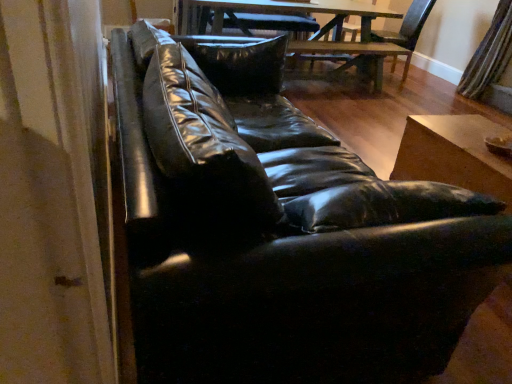
You are a GUI agent. You are given a task and a screenshot of the screen. Output one action in this format:
    pyautogui.click(x=<x>, y=<y>)
    Task: Click on the wooden table at center, which is the 2th table from bottom to top
    This screenshot has width=512, height=384.
    Given the screenshot: What is the action you would take?
    click(x=319, y=30)

This screenshot has width=512, height=384. What do you see at coordinates (406, 32) in the screenshot?
I see `dark wood swivel chair at center` at bounding box center [406, 32].

Find the location of `wooden table at center, which ranks as the first table in back-to-front order`. wooden table at center, which ranks as the first table in back-to-front order is located at coordinates (319, 30).

From a real-world perspective, is striped fabric curtain at right physically above dark wood swivel chair at center?

Correct, in the physical world, striped fabric curtain at right is higher than dark wood swivel chair at center.

Between striped fabric curtain at right and dark wood swivel chair at center, which one is positioned in front?

striped fabric curtain at right is in front.

From the image's perspective, does striped fabric curtain at right appear lower than dark wood swivel chair at center?

Yes.

Is point (490, 76) closer or farther from the camera than point (408, 19)?

Point (490, 76) is positioned closer to the camera compared to point (408, 19).

Considering the relative sizes of dark wood swivel chair at center and wooden table at lower right, which appears as the first table when ordered from the bottom, in the image provided, is dark wood swivel chair at center thinner than wooden table at lower right, which appears as the first table when ordered from the bottom,?

No.

Based on the photo, is dark wood swivel chair at center positioned with its back to wooden table at lower right, which appears as the first table when ordered from the bottom?

No, dark wood swivel chair at center is not facing the opposite direction of wooden table at lower right, which appears as the first table when ordered from the bottom.

From the image's perspective, which object appears higher, dark wood swivel chair at center or wooden table at lower right, placed as the 2th table when sorted from back to front?

dark wood swivel chair at center appears higher in the image.

Is dark wood swivel chair at center positioned behind wooden table at lower right, placed as the 2th table when sorted from back to front?

Yes, dark wood swivel chair at center is further from the viewer.

Based on the photo, is wooden table at lower right, positioned as the second table in top-to-bottom order, oriented away from wooden table at center, which is the 2th table from bottom to top?

No, wooden table at center, which is the 2th table from bottom to top, is not at the back of wooden table at lower right, positioned as the second table in top-to-bottom order.

From a real-world perspective, between wooden table at lower right, placed as the 2th table when sorted from back to front, and wooden table at center, which ranks as the first table in back-to-front order, who is vertically lower?

From a 3D spatial view, wooden table at lower right, placed as the 2th table when sorted from back to front, is below.

Is wooden table at lower right, which appears as the first table when ordered from the bottom, not inside wooden table at center, which ranks as the first table in back-to-front order?

Yes, wooden table at lower right, which appears as the first table when ordered from the bottom, is not within wooden table at center, which ranks as the first table in back-to-front order.

Between wooden table at lower right, positioned as the second table in top-to-bottom order, and wooden table at center, which ranks as the first table in back-to-front order, which one has smaller width?

wooden table at lower right, positioned as the second table in top-to-bottom order.

From the picture: Which of these two, wooden table at center, which is the 2th table from front to back, or striped fabric curtain at right, stands shorter?

With less height is wooden table at center, which is the 2th table from front to back.

Is wooden table at center, acting as the 1th table starting from the top, turned away from striped fabric curtain at right?

No, wooden table at center, acting as the 1th table starting from the top, is not facing away from striped fabric curtain at right.

Is wooden table at center, acting as the 1th table starting from the top, not inside striped fabric curtain at right?

Absolutely, wooden table at center, acting as the 1th table starting from the top, is external to striped fabric curtain at right.

Which of these two, wooden table at lower right, placed as the 2th table when sorted from back to front, or dark wood swivel chair at center, is thinner?

With smaller width is wooden table at lower right, placed as the 2th table when sorted from back to front.

Would you say wooden table at lower right, placed as the 2th table when sorted from back to front, is to the left or to the right of dark wood swivel chair at center in the picture?

From the image, it's evident that wooden table at lower right, placed as the 2th table when sorted from back to front, is to the left of dark wood swivel chair at center.

Is the surface of wooden table at lower right, which appears as the first table when ordered from the bottom, in direct contact with dark wood swivel chair at center?

There is a gap between wooden table at lower right, which appears as the first table when ordered from the bottom, and dark wood swivel chair at center.

Between wooden table at lower right, placed as the 2th table when sorted from back to front, and dark wood swivel chair at center, which one has smaller size?

wooden table at lower right, placed as the 2th table when sorted from back to front, is smaller.

The image size is (512, 384). Find the location of `swivel chair that is above the wooden table at center, acting as the 1th table starting from the top (from a real-world perspective)`. swivel chair that is above the wooden table at center, acting as the 1th table starting from the top (from a real-world perspective) is located at coordinates (406, 32).

From the picture: From a real-world perspective, who is located lower, wooden table at center, which is the 2th table from bottom to top, or dark wood swivel chair at center?

wooden table at center, which is the 2th table from bottom to top, is physically lower.

Is there a large distance between wooden table at center, which is the 2th table from front to back, and dark wood swivel chair at center?

No, there isn't a large distance between wooden table at center, which is the 2th table from front to back, and dark wood swivel chair at center.

Which object is thinner, wooden table at center, which ranks as the first table in back-to-front order, or dark wood swivel chair at center?

dark wood swivel chair at center is thinner.

Is striped fabric curtain at right in contact with wooden table at lower right, placed as the 2th table when sorted from back to front?

No, striped fabric curtain at right is not with wooden table at lower right, placed as the 2th table when sorted from back to front.

Considering the sizes of objects striped fabric curtain at right and wooden table at lower right, which appears as the first table when ordered from the bottom, in the image provided, who is thinner, striped fabric curtain at right or wooden table at lower right, which appears as the first table when ordered from the bottom,?

With smaller width is striped fabric curtain at right.

Is striped fabric curtain at right positioned behind wooden table at lower right, which is counted as the first table, starting from the front?

Yes, it is.

Would you say striped fabric curtain at right is to the left or to the right of wooden table at lower right, placed as the 2th table when sorted from back to front, in the picture?

Clearly, striped fabric curtain at right is on the right of wooden table at lower right, placed as the 2th table when sorted from back to front, in the image.

Find the location of `curtain on the right of the dark wood swivel chair at center`. curtain on the right of the dark wood swivel chair at center is located at coordinates (x=489, y=55).

Locate an element on the screen. This screenshot has width=512, height=384. swivel chair behind the wooden table at lower right, positioned as the second table in top-to-bottom order is located at coordinates (406, 32).

Which object lies nearer to the anchor point wooden table at lower right, positioned as the second table in top-to-bottom order, wooden table at center, which ranks as the first table in back-to-front order, or dark wood swivel chair at center?

Based on the image, wooden table at center, which ranks as the first table in back-to-front order, appears to be nearer to wooden table at lower right, positioned as the second table in top-to-bottom order.

Based on their spatial positions, is wooden table at lower right, which is counted as the first table, starting from the front, or striped fabric curtain at right closer to dark wood swivel chair at center?

striped fabric curtain at right is positioned closer to the anchor dark wood swivel chair at center.

Based on their spatial positions, is dark wood swivel chair at center or wooden table at lower right, positioned as the second table in top-to-bottom order, closer to wooden table at center, which is the 2th table from bottom to top?

Among the two, dark wood swivel chair at center is located nearer to wooden table at center, which is the 2th table from bottom to top.

Looking at the image, which one is located further to wooden table at lower right, positioned as the second table in top-to-bottom order, wooden table at center, which is the 2th table from bottom to top, or striped fabric curtain at right?

striped fabric curtain at right lies further to wooden table at lower right, positioned as the second table in top-to-bottom order, than the other object.

From the picture: Which object lies nearer to the anchor point striped fabric curtain at right, dark wood swivel chair at center or wooden table at lower right, which appears as the first table when ordered from the bottom?

Based on the image, dark wood swivel chair at center appears to be nearer to striped fabric curtain at right.

From the picture: From the image, which object appears to be farther from wooden table at center, which ranks as the first table in back-to-front order, wooden table at lower right, positioned as the second table in top-to-bottom order, or dark wood swivel chair at center?

The object further to wooden table at center, which ranks as the first table in back-to-front order, is wooden table at lower right, positioned as the second table in top-to-bottom order.

Looking at the image, which one is located closer to wooden table at lower right, which appears as the first table when ordered from the bottom, dark wood swivel chair at center or striped fabric curtain at right?

striped fabric curtain at right lies closer to wooden table at lower right, which appears as the first table when ordered from the bottom, than the other object.

Estimate the real-world distances between objects in this image. Which object is closer to striped fabric curtain at right, wooden table at lower right, placed as the 2th table when sorted from back to front, or wooden table at center, which ranks as the first table in back-to-front order?

wooden table at center, which ranks as the first table in back-to-front order, is positioned closer to the anchor striped fabric curtain at right.

The width and height of the screenshot is (512, 384). What are the coordinates of `table positioned between wooden table at lower right, placed as the 2th table when sorted from back to front, and striped fabric curtain at right from near to far` in the screenshot? It's located at (319, 30).

Identify the location of table between wooden table at lower right, which appears as the first table when ordered from the bottom, and dark wood swivel chair at center, along the z-axis. (319, 30).

Image resolution: width=512 pixels, height=384 pixels. I want to click on swivel chair situated between wooden table at center, which ranks as the first table in back-to-front order, and striped fabric curtain at right from left to right, so click(406, 32).

At what (x,y) coordinates should I click in order to perform the action: click on curtain located between wooden table at lower right, which is counted as the first table, starting from the front, and dark wood swivel chair at center in the depth direction. Please return your answer as a coordinate pair (x, y). The height and width of the screenshot is (384, 512). Looking at the image, I should click on (489, 55).